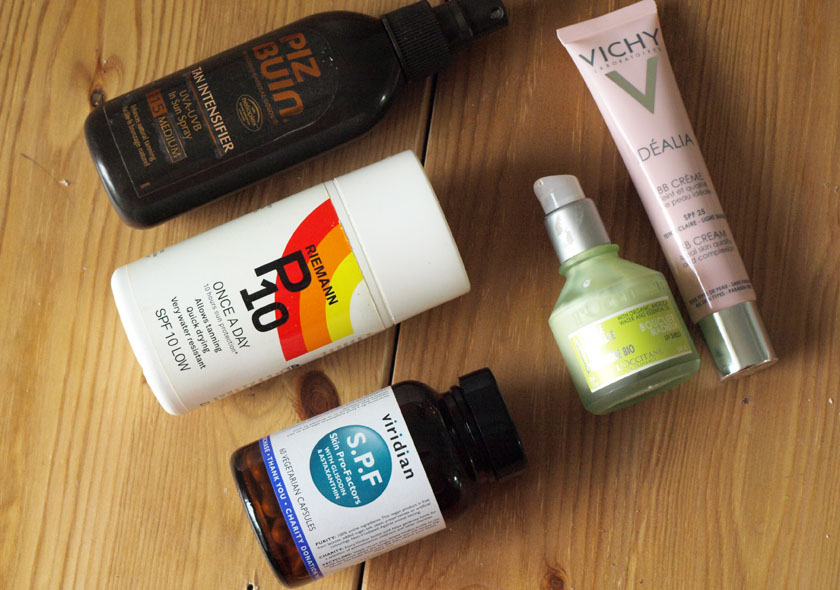
Where is `1 right wooden plank`? 1 right wooden plank is located at coordinates (723, 534).